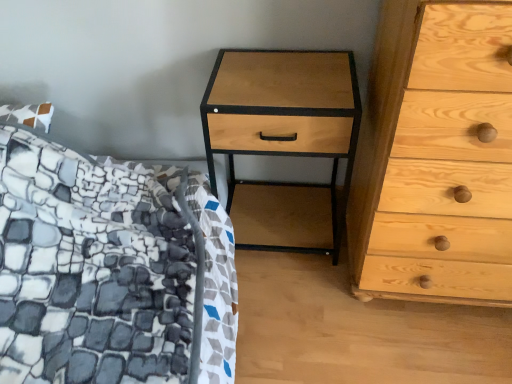
The width and height of the screenshot is (512, 384). Identify the location of empty space that is ontop of natural wood nightstand at center (from a real-world perspective). (273, 76).